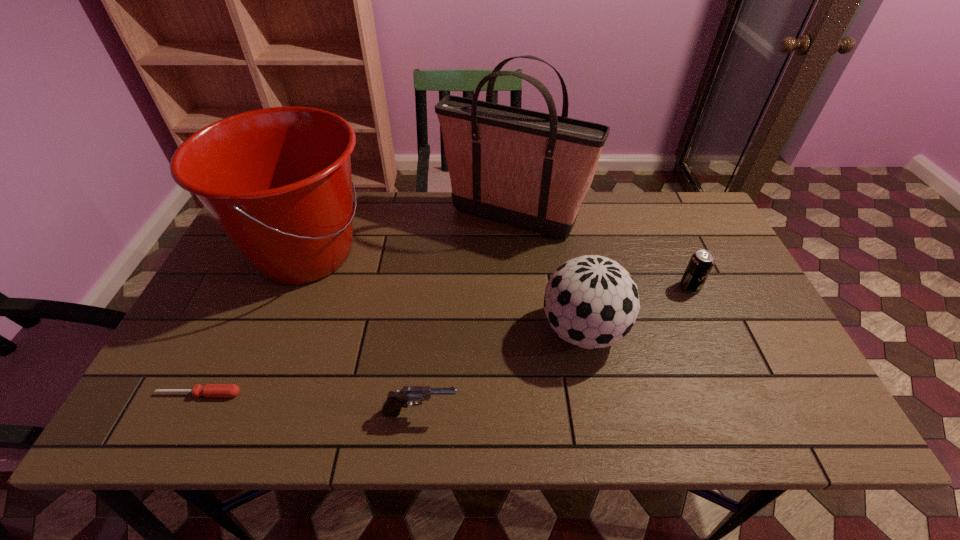
This screenshot has width=960, height=540. In order to click on object that is at the far left corner in this screenshot , I will do `click(278, 182)`.

Identify the location of object that is positioned at the near left corner. (210, 390).

The height and width of the screenshot is (540, 960). In order to click on free space at the far edge of the desktop in this screenshot , I will do `click(583, 227)`.

Find the location of a particular element. Image resolution: width=960 pixels, height=540 pixels. vacant space at the near edge of the desktop is located at coordinates (685, 400).

The width and height of the screenshot is (960, 540). I want to click on vacant space at the right edge of the desktop, so click(x=732, y=320).

In the image, there is a desktop. Identify the location of vacant space at the near left corner. This screenshot has height=540, width=960. (138, 415).

Where is `vacant space at the far right corner of the desktop`? vacant space at the far right corner of the desktop is located at coordinates (670, 228).

You are a GUI agent. You are given a task and a screenshot of the screen. Output one action in this format:
    pyautogui.click(x=<x>, y=<y>)
    Task: Click on the vacant space at the near right corner of the desktop
    
    Given the screenshot: What is the action you would take?
    pyautogui.click(x=804, y=415)

In order to click on vacant area that lies between the soda can and the screwdriver in this screenshot , I will do `click(444, 340)`.

The image size is (960, 540). I want to click on unoccupied area between the nearest object and the soccer ball, so tap(501, 372).